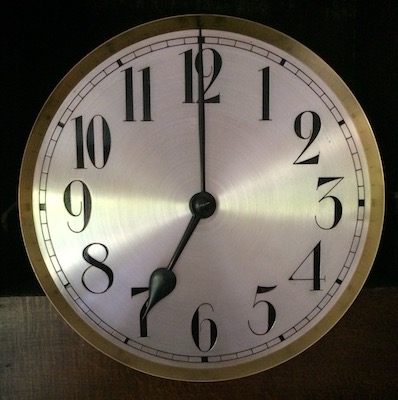
You are a GUI agent. You are given a task and a screenshot of the screen. Output one action in this format:
    pyautogui.click(x=<x>, y=<y>)
    Task: Click on the center of clock where hands come together
    This screenshot has width=398, height=400.
    Given the screenshot: What is the action you would take?
    pyautogui.click(x=203, y=202)